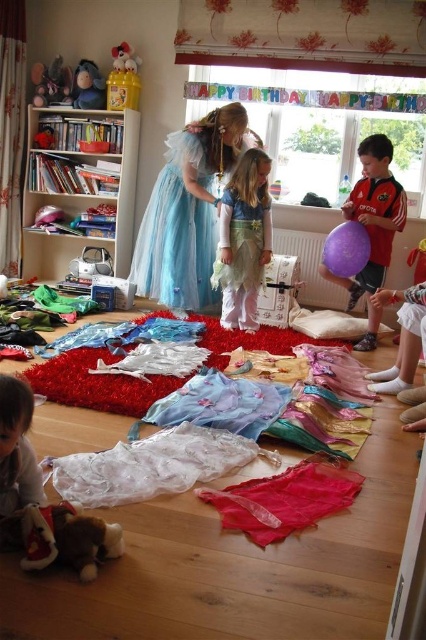
You are a parent organizing a childrens party and need to place a new toy box between the white wooden bookshelf at left and the matte plastic toy at upper left. The toy box is 22 inches wide. Will it fit in the space between them?

→ The distance between the white wooden bookshelf at left and the matte plastic toy at upper left is 21.93 inches. Since the toy box is 22 inches wide, it will not fit as it is slightly wider than the available space.

You are a child at the birthday party and want to pick up both the brown plush toy at lower left and the soft beige fabric at lower left. Which one should you grab first if you want to pick the one closer to your left?

The soft beige fabric at lower left is on the left side of the brown plush toy at lower left, so you should grab the soft beige fabric at lower left first.

You are a child at the birthday party and want to choose between the blue tulle dress at center and the matte red balloon at right. Which item is bigger?

The blue tulle dress at center is larger in size than the matte red balloon at right.